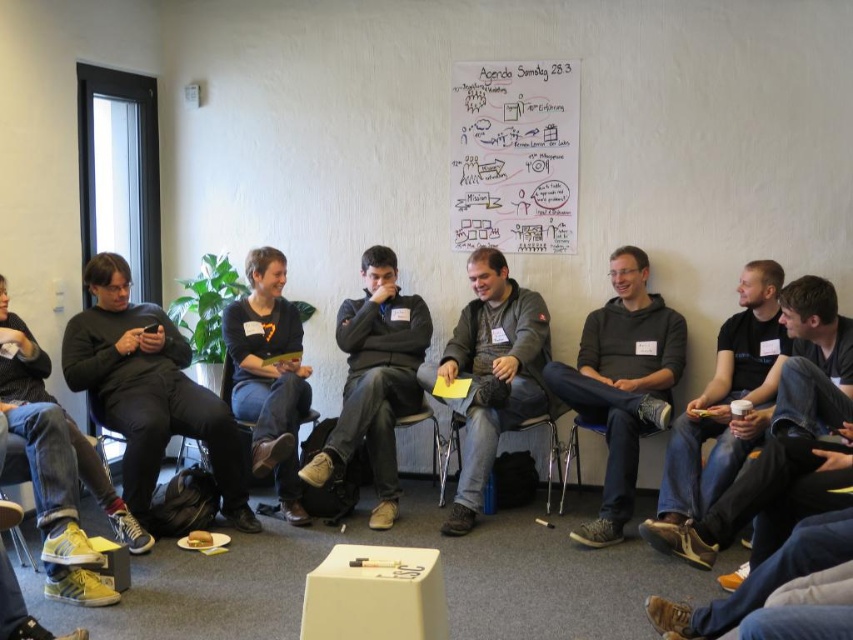
Question: Estimate the real-world distances between objects in this image. Which object is closer to the yellow leather sneakers at lower left?

Choices:
 (A) dark gray sweater at center
 (B) black matte jacket at left
 (C) black fabric shirt at center

Answer: (B)

Question: Does dark gray sweater at center have a smaller size compared to black fabric shirt at center?

Choices:
 (A) yes
 (B) no

Answer: (B)

Question: Which object is positioned closest to the black fabric shirt at center?

Choices:
 (A) yellow leather sneakers at lower left
 (B) dark gray hoodie at center
 (C) black matte jacket at left

Answer: (B)

Question: Can you confirm if black matte jacket at left is wider than yellow leather sneakers at lower left?

Choices:
 (A) yes
 (B) no

Answer: (A)

Question: Which object is the closest to the black fabric shirt at center?

Choices:
 (A) black matte jacket at left
 (B) dark gray sweater at center

Answer: (B)

Question: Is dark gray hoodie at center wider than yellow leather sneakers at lower left?

Choices:
 (A) yes
 (B) no

Answer: (A)